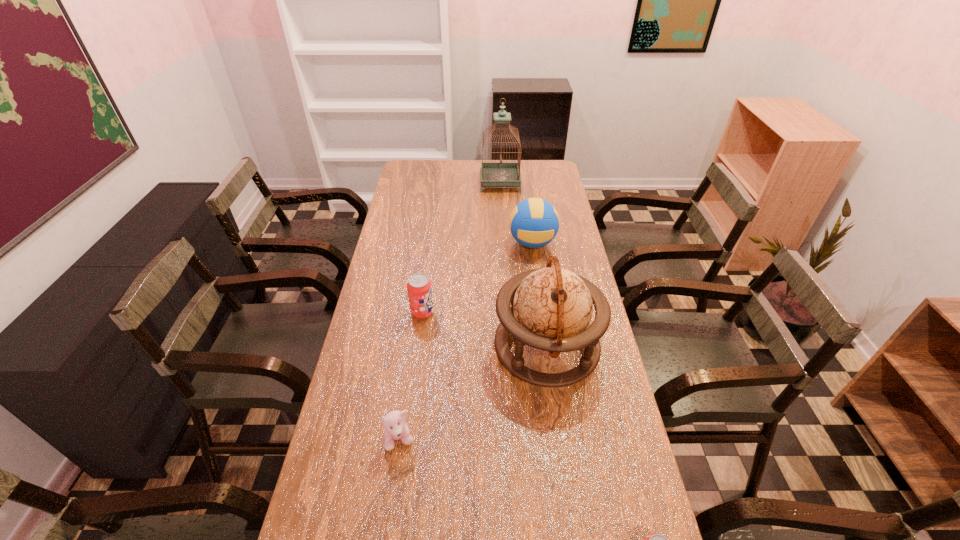
The height and width of the screenshot is (540, 960). I want to click on vacant space at the far edge of the desktop, so click(462, 164).

Identify the location of vacant space at the left edge of the desktop. The height and width of the screenshot is (540, 960). (357, 406).

Where is `free space at the right edge of the desktop`? This screenshot has height=540, width=960. free space at the right edge of the desktop is located at coordinates (533, 187).

Image resolution: width=960 pixels, height=540 pixels. I want to click on vacant space at the far right corner of the desktop, so click(531, 164).

Where is `vacant area that lies between the farthest object and the second tallest object`? The width and height of the screenshot is (960, 540). vacant area that lies between the farthest object and the second tallest object is located at coordinates (523, 265).

In order to click on free area in between the teddy bear and the second farthest object in this screenshot , I will do `click(467, 342)`.

In order to click on free space between the farthest object and the globe in this screenshot , I will do `click(523, 265)`.

At what (x,y) coordinates should I click in order to perform the action: click on vacant space that's between the teddy bear and the farther soda can. Please return your answer as a coordinate pair (x, y). Looking at the image, I should click on (411, 376).

You are a GUI agent. You are given a task and a screenshot of the screen. Output one action in this format:
    pyautogui.click(x=<x>, y=<y>)
    Task: Click on the vacant point located between the fourth shortest object and the farther soda can
    This screenshot has height=540, width=960.
    Given the screenshot: What is the action you would take?
    pyautogui.click(x=477, y=278)

This screenshot has height=540, width=960. In order to click on empty location between the globe and the teddy bear in this screenshot , I will do `click(473, 394)`.